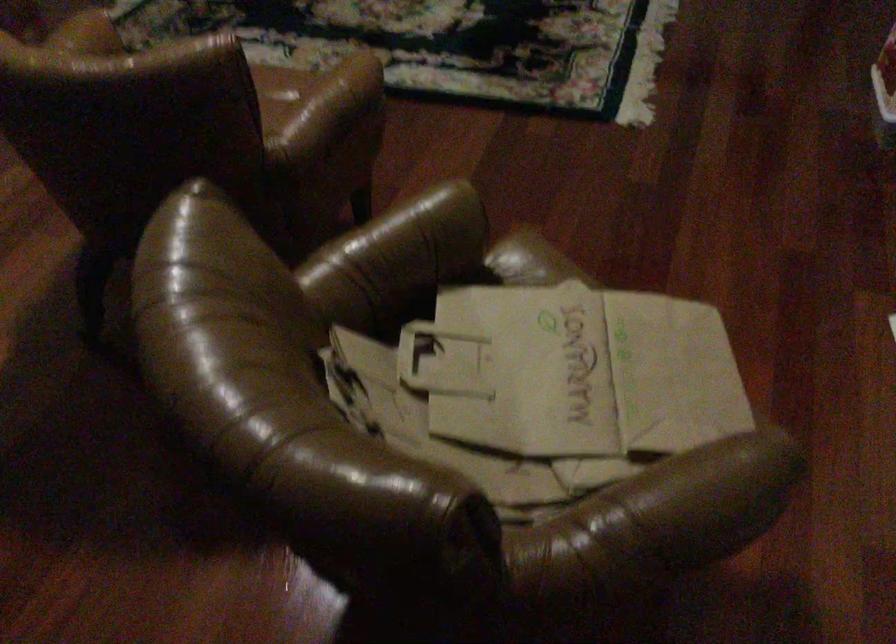
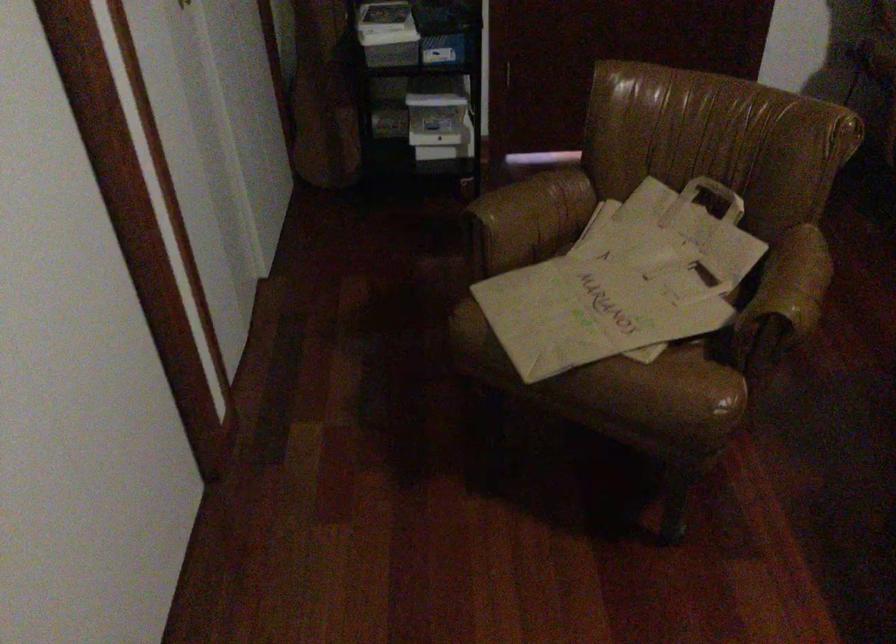
Find the pixel in the second image that matches pixel 278 390 in the first image.

(716, 194)